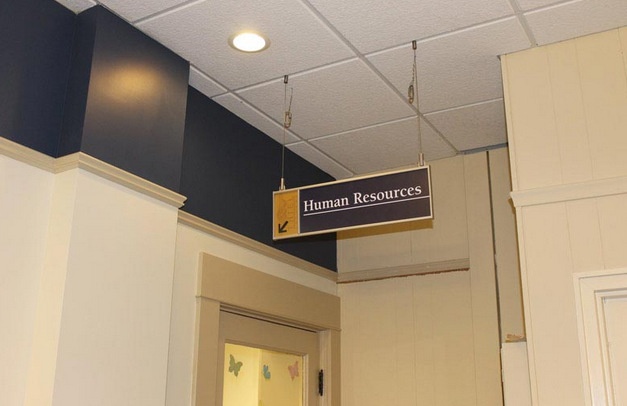
Where is `ceiling tiles`? This screenshot has height=406, width=627. ceiling tiles is located at coordinates (310, 44), (372, 28), (360, 56), (359, 100).